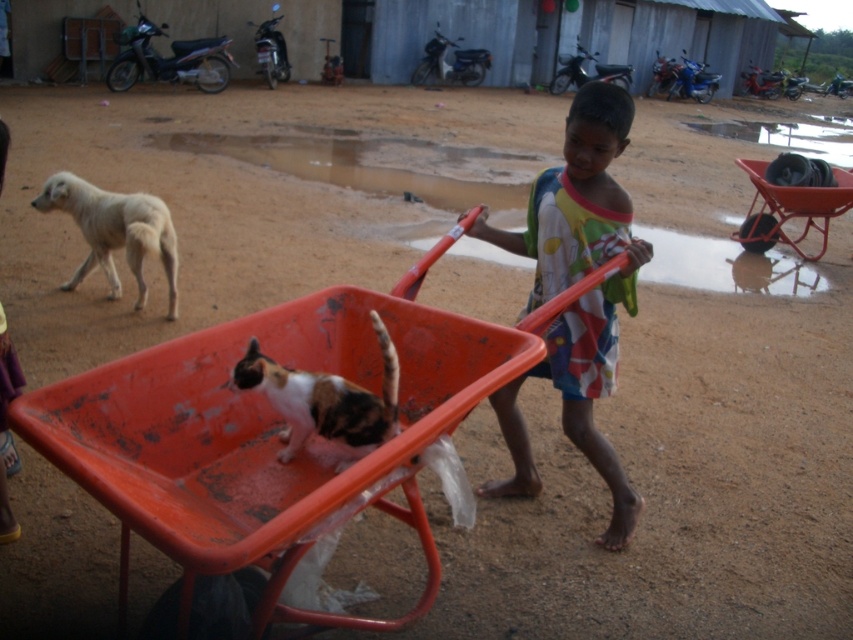
Question: Is multicolored fabric shirt at center to the right of white fur dog at left from the viewer's perspective?

Choices:
 (A) yes
 (B) no

Answer: (A)

Question: Among these objects, which one is nearest to the camera?

Choices:
 (A) calico fur cat at center
 (B) white fur dog at left
 (C) orange plastic wheelbarrow at center
 (D) orange plastic cart at center

Answer: (D)

Question: Among these points, which one is nearest to the camera?

Choices:
 (A) (125, 230)
 (B) (521, 353)
 (C) (759, 180)
 (D) (396, 364)

Answer: (B)

Question: Can you confirm if calico fur cat at center is positioned to the right of white fur dog at left?

Choices:
 (A) yes
 (B) no

Answer: (A)

Question: Among these points, which one is nearest to the camera?

Choices:
 (A) (386, 328)
 (B) (764, 250)
 (C) (430, 534)

Answer: (C)

Question: From the image, what is the correct spatial relationship of orange plastic cart at center in relation to calico fur cat at center?

Choices:
 (A) left
 (B) right

Answer: (B)